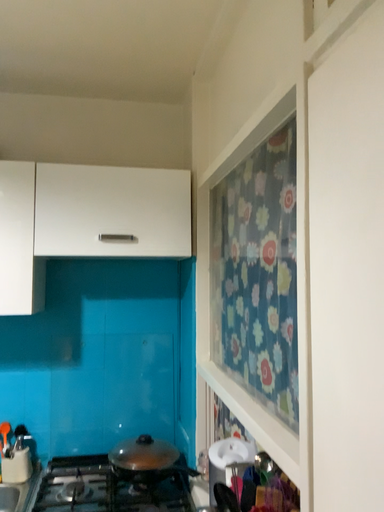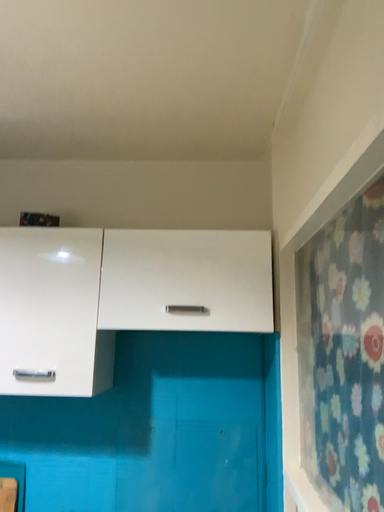
Question: Which way did the camera rotate in the video?

Choices:
 (A) rotated left
 (B) rotated right

Answer: (A)